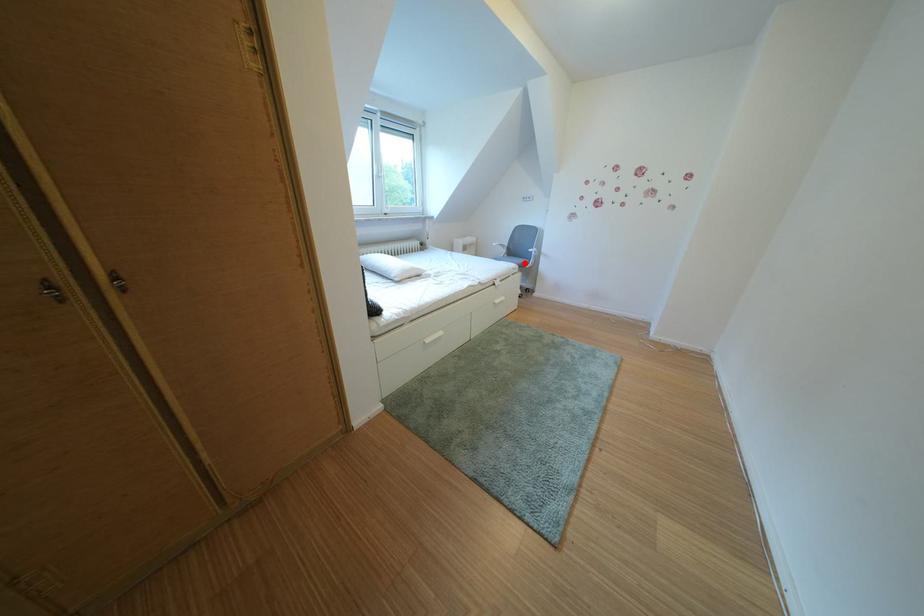
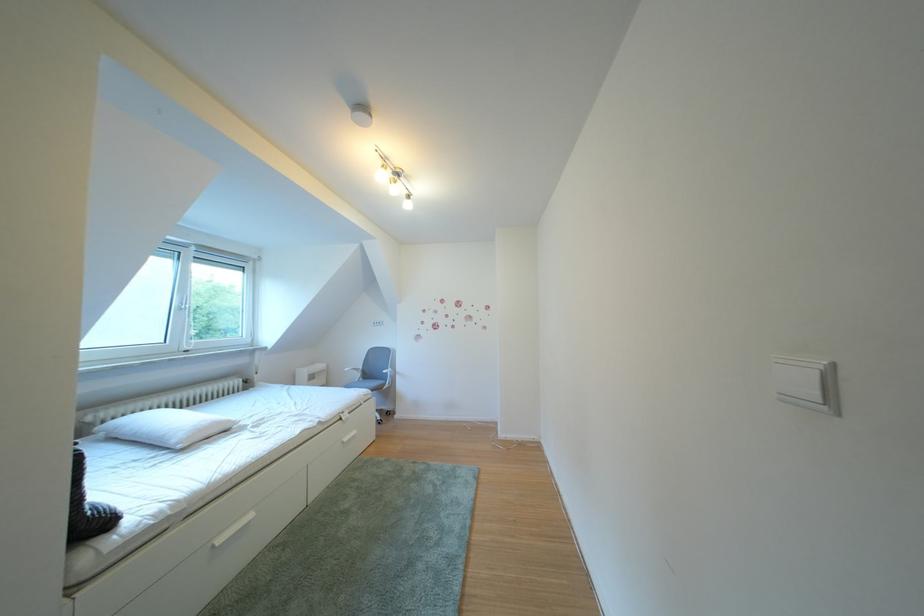
Find the pixel in the second image that matches the highlighted location in the first image.

(381, 387)